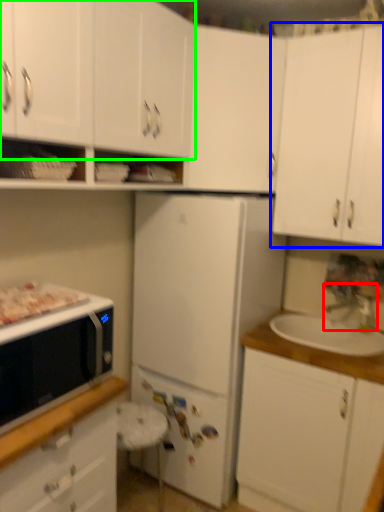
Question: Considering the real-world distances, which object is closest to faucet (highlighted by a red box)? cabinetry (highlighted by a blue box) or cabinetry (highlighted by a green box).

Choices:
 (A) cabinetry
 (B) cabinetry

Answer: (A)